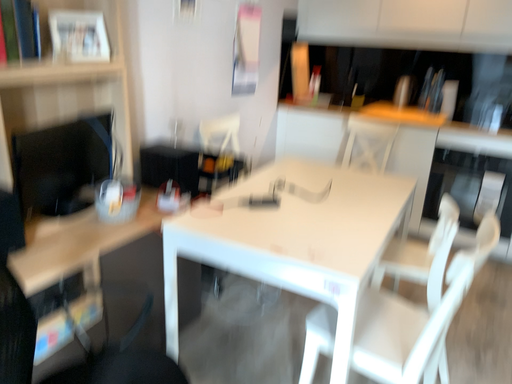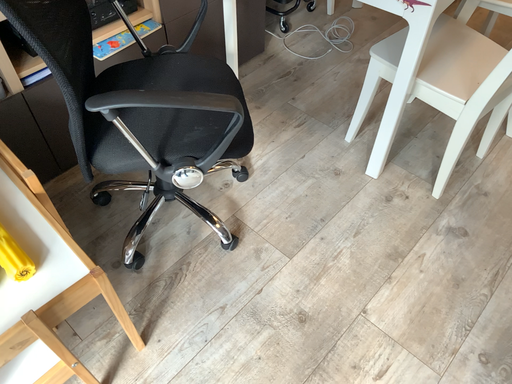
Question: Which way did the camera rotate in the video?

Choices:
 (A) rotated left
 (B) rotated right

Answer: (A)